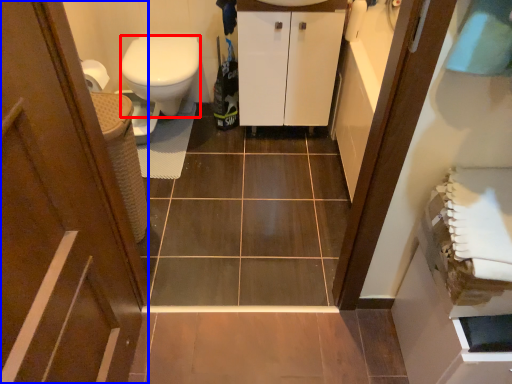
Question: Which object appears closest to the camera in this image, bidet (highlighted by a red box) or door (highlighted by a blue box)?

Choices:
 (A) bidet
 (B) door

Answer: (B)